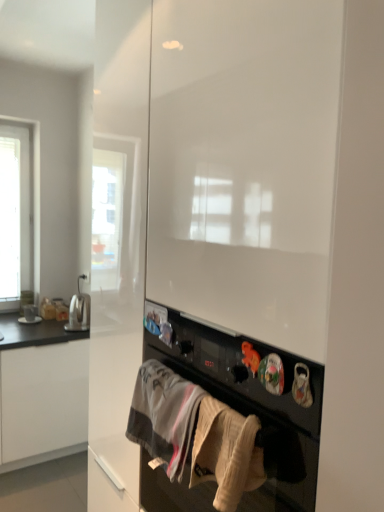
Question: Based on their sizes in the image, would you say black matte oven at center is bigger or smaller than satin silver toaster at left?

Choices:
 (A) big
 (B) small

Answer: (A)

Question: From a real-world perspective, is black matte oven at center physically located above or below satin silver toaster at left?

Choices:
 (A) above
 (B) below

Answer: (A)

Question: Estimate the real-world distances between objects in this image. Which object is farther from the white glossy cabinet at left?

Choices:
 (A) beige cotton towel at lower center, which is the first clothing from right to left
 (B) white cotton towel at lower center, marked as the 2th clothing in a front-to-back arrangement
 (C) satin silver toaster at left
 (D) black matte oven at center

Answer: (A)

Question: Estimate the real-world distances between objects in this image. Which object is closer to the satin silver toaster at left?

Choices:
 (A) beige cotton towel at lower center, which appears as the first clothing when viewed from the front
 (B) black matte oven at center
 (C) white cotton towel at lower center, the 1th clothing in the back-to-front sequence
 (D) white glossy cabinet at left

Answer: (D)